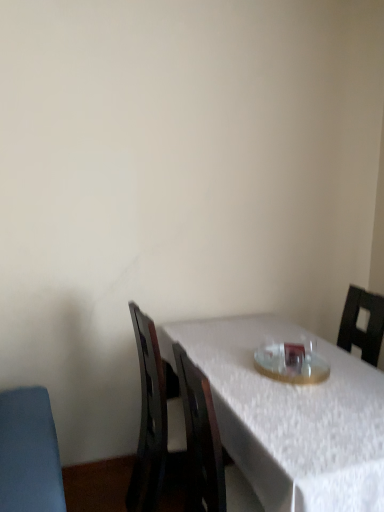
At what (x,y) coordinates should I click in order to perform the action: click on unoccupied area in front of clear glass plate at center. Please return your answer as a coordinate pair (x, y). Looking at the image, I should click on (308, 401).